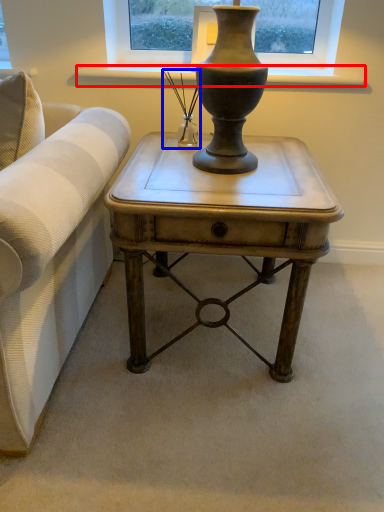
Question: Which of the following is the closest to the observer, window sill (highlighted by a red box) or candle holder (highlighted by a blue box)?

Choices:
 (A) window sill
 (B) candle holder

Answer: (B)